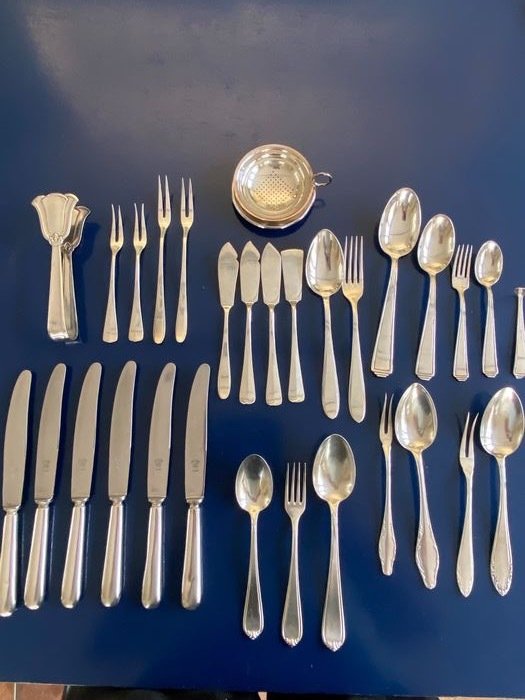
Find the location of a particular element. This screenshot has width=525, height=700. fork is located at coordinates (107, 294), (136, 281), (159, 276), (183, 272), (390, 472), (474, 486), (296, 536), (355, 344), (461, 311).